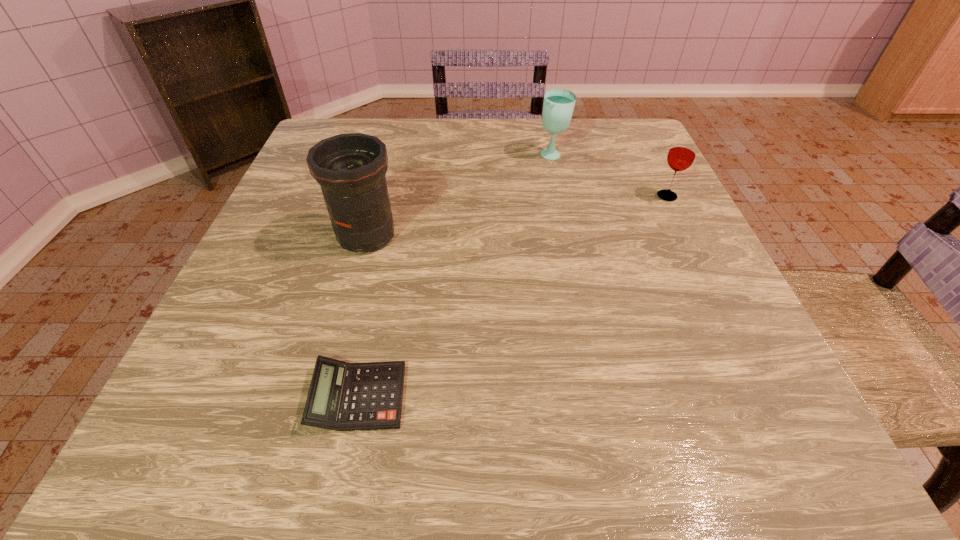
At what (x,y) coordinates should I click in order to perform the action: click on free spot between the second nearest object and the rightmost object. Please return your answer as a coordinate pair (x, y). Looking at the image, I should click on pyautogui.click(x=516, y=216).

What are the coordinates of `empty location between the right glass and the tallest object` in the screenshot? It's located at (516, 216).

Identify which object is located as the nearest to the nearest object. Please provide its 2D coordinates. Your answer should be formatted as a tuple, i.e. [(x, y)], where the tuple contains the x and y coordinates of a point satisfying the conditions above.

[(350, 168)]

Identify which object is the third nearest to the calculator. Please provide its 2D coordinates. Your answer should be formatted as a tuple, i.e. [(x, y)], where the tuple contains the x and y coordinates of a point satisfying the conditions above.

[(682, 153)]

Where is `vacant space that satisfies the following two spatial constraints: 1. on the back side of the telephoto lens; 2. on the right side of the farthest object`? vacant space that satisfies the following two spatial constraints: 1. on the back side of the telephoto lens; 2. on the right side of the farthest object is located at coordinates pyautogui.click(x=389, y=156).

Identify the location of free space that satisfies the following two spatial constraints: 1. on the back side of the shortest object; 2. on the right side of the farther glass. (x=409, y=156).

Locate an element on the screen. This screenshot has width=960, height=540. vacant region that satisfies the following two spatial constraints: 1. on the front side of the telephoto lens; 2. on the right side of the shortest object is located at coordinates (323, 396).

The height and width of the screenshot is (540, 960). Identify the location of vacant region that satisfies the following two spatial constraints: 1. on the back side of the tallest object; 2. on the right side of the farthest object. (389, 156).